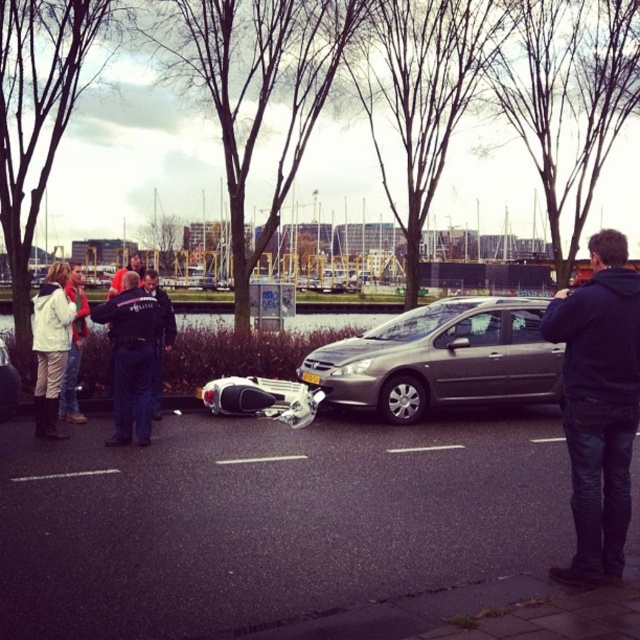
Question: Is black uniformed officer at center below white matte jacket at left?

Choices:
 (A) no
 (B) yes

Answer: (B)

Question: Can you confirm if dark blue hoodie at right is smaller than black uniformed officer at center?

Choices:
 (A) no
 (B) yes

Answer: (B)

Question: Can you confirm if black uniformed officer at center is positioned to the right of white matte jacket at left?

Choices:
 (A) yes
 (B) no

Answer: (A)

Question: Which of the following is the closest to the observer?

Choices:
 (A) dark blue hoodie at right
 (B) metallic silver car at center

Answer: (A)

Question: Which point is farther to the camera?

Choices:
 (A) (577, 362)
 (B) (131, 275)
 (C) (49, 289)

Answer: (C)

Question: Among these points, which one is farthest from the camera?

Choices:
 (A) (1, 381)
 (B) (54, 424)
 (C) (428, 616)
 (D) (147, 368)

Answer: (B)